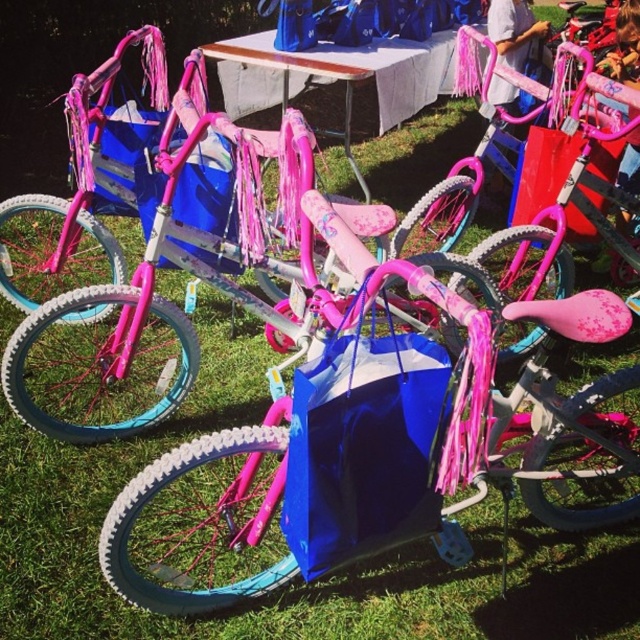
Question: Which object is farther from the camera taking this photo?

Choices:
 (A) white plastic picnic table at center
 (B) blue glossy bag at center

Answer: (A)

Question: Can you confirm if blue glossy bag at center is smaller than white plastic picnic table at center?

Choices:
 (A) no
 (B) yes

Answer: (B)

Question: Which point is farther from the camera taking this photo?

Choices:
 (A) (584, 339)
 (B) (246, 100)

Answer: (B)

Question: Observing the image, what is the correct spatial positioning of blue glossy bag at center in reference to white plastic picnic table at center?

Choices:
 (A) left
 (B) right

Answer: (B)

Question: Does blue glossy bag at center appear over white plastic picnic table at center?

Choices:
 (A) yes
 (B) no

Answer: (B)